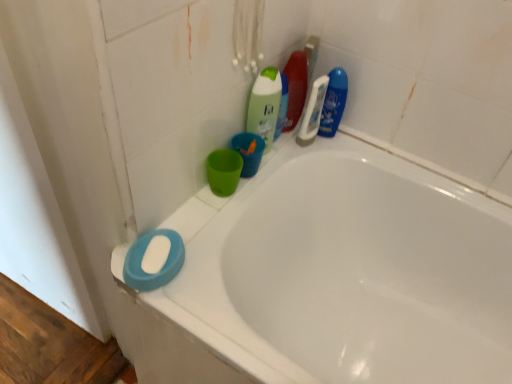
Image resolution: width=512 pixels, height=384 pixels. Find the location of `vacant area that lies to the right of blue glossy bottle at upper right, which is the 1th cleaning product from right to left`. vacant area that lies to the right of blue glossy bottle at upper right, which is the 1th cleaning product from right to left is located at coordinates (375, 152).